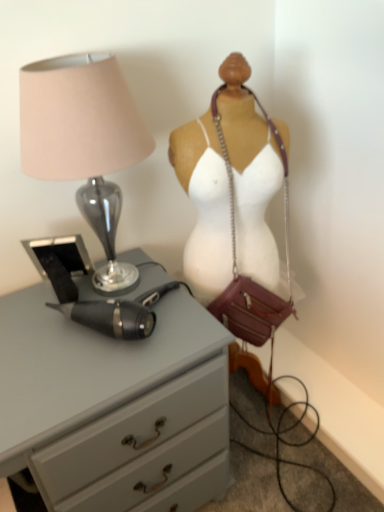
What do you see at coordinates (232, 188) in the screenshot? I see `leather/chain strap at center` at bounding box center [232, 188].

What do you see at coordinates (114, 406) in the screenshot? The image size is (384, 512). I see `matte gray chest of drawers at left` at bounding box center [114, 406].

Find the location of a particular element. matte glass lamp at left is located at coordinates (84, 141).

Where is `leather/chain strap at center`? leather/chain strap at center is located at coordinates (232, 188).

From a real-world perspective, does matte gray chest of drawers at left stand above matte glass lamp at left?

No, from a real-world perspective, matte gray chest of drawers at left is not over matte glass lamp at left

Is point (159, 402) closer to viewer compared to point (125, 106)?

That is False.

Considering the relative sizes of matte gray chest of drawers at left and matte glass lamp at left in the image provided, is matte gray chest of drawers at left smaller than matte glass lamp at left?

No, matte gray chest of drawers at left is not smaller than matte glass lamp at left.

Locate an element on the screen. lamp above the matte gray chest of drawers at left (from the image's perspective) is located at coordinates (84, 141).

Is matte glass lamp at left bigger or smaller than matte gray chest of drawers at left?

matte glass lamp at left is smaller than matte gray chest of drawers at left.

Is matte glass lamp at left beside matte gray chest of drawers at left?

No, matte glass lamp at left is not next to matte gray chest of drawers at left.

From a real-world perspective, is matte glass lamp at left under matte gray chest of drawers at left?

No, from a real-world perspective, matte glass lamp at left is not below matte gray chest of drawers at left.

Which of these two, matte gray chest of drawers at left or leather/chain strap at center, stands taller?

Standing taller between the two is leather/chain strap at center.

What's the angular difference between matte gray chest of drawers at left and leather/chain strap at center's facing directions?

The angle between the facing direction of matte gray chest of drawers at left and the facing direction of leather/chain strap at center is 21.4 degrees.

Considering the relative positions of matte gray chest of drawers at left and leather/chain strap at center in the image provided, is matte gray chest of drawers at left to the left or to the right of leather/chain strap at center?

Clearly, matte gray chest of drawers at left is on the left of leather/chain strap at center in the image.

Which of these two, matte gray chest of drawers at left or leather/chain strap at center, is bigger?

With larger size is matte gray chest of drawers at left.

In the scene shown: Between matte glass lamp at left and leather/chain strap at center, which one has more height?

leather/chain strap at center.

Is matte glass lamp at left at the left side of leather/chain strap at center?

Yes.

Who is more distant, matte glass lamp at left or leather/chain strap at center?

leather/chain strap at center is more distant.

How many degrees apart are the facing directions of matte glass lamp at left and leather/chain strap at center?

The facing directions of matte glass lamp at left and leather/chain strap at center are 21.4 degrees apart.

Considering the positions of point (261, 252) and point (124, 267), is point (261, 252) closer or farther from the camera than point (124, 267)?

Point (261, 252).

In the image, is leather/chain strap at center on the left side or the right side of matte glass lamp at left?

Based on their positions, leather/chain strap at center is located to the right of matte glass lamp at left.

Looking at this image, considering the relative positions of leather/chain strap at center and matte glass lamp at left in the image provided, is leather/chain strap at center behind matte glass lamp at left?

Yes.

From a real-world perspective, who is located higher, leather/chain strap at center or matte glass lamp at left?

matte glass lamp at left.

Is leather/chain strap at center not near matte gray chest of drawers at left?

They are positioned close to each other.

From a real-world perspective, is leather/chain strap at center physically located above or below matte gray chest of drawers at left?

In terms of real-world spatial position, leather/chain strap at center is above matte gray chest of drawers at left.

Can you confirm if leather/chain strap at center is wider than matte gray chest of drawers at left?

No, leather/chain strap at center is not wider than matte gray chest of drawers at left.

From the picture: Does leather/chain strap at center have a smaller size compared to matte gray chest of drawers at left?

Yes.

I want to click on the chest of drawers directly beneath the matte glass lamp at left (from a real-world perspective), so (x=114, y=406).

In order to click on lamp behind the matte gray chest of drawers at left in this screenshot , I will do `click(84, 141)`.

Based on their spatial positions, is leather/chain strap at center or matte gray chest of drawers at left further from matte glass lamp at left?

matte gray chest of drawers at left is further to matte glass lamp at left.

Based on their spatial positions, is matte glass lamp at left or matte gray chest of drawers at left closer to leather/chain strap at center?

matte glass lamp at left is closer to leather/chain strap at center.

Consider the image. Which object lies nearer to the anchor point matte gray chest of drawers at left, leather/chain strap at center or matte glass lamp at left?

leather/chain strap at center lies closer to matte gray chest of drawers at left than the other object.

Which object lies further to the anchor point matte glass lamp at left, matte gray chest of drawers at left or leather/chain strap at center?

The object further to matte glass lamp at left is matte gray chest of drawers at left.

Estimate the real-world distances between objects in this image. Which object is further from matte gray chest of drawers at left, matte glass lamp at left or leather/chain strap at center?

matte glass lamp at left lies further to matte gray chest of drawers at left than the other object.

Considering their positions, is matte gray chest of drawers at left positioned closer to leather/chain strap at center than matte glass lamp at left?

Based on the image, matte glass lamp at left appears to be nearer to leather/chain strap at center.

This screenshot has height=512, width=384. What are the coordinates of `mannequin that lies between matte glass lamp at left and matte gray chest of drawers at left from top to bottom` in the screenshot? It's located at (232, 188).